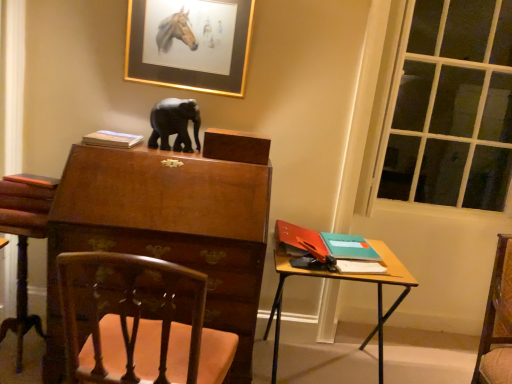
Question: From a real-world perspective, is matte paper book at upper left, the 1th book when ordered from left to right, positioned under transparent glass window at right based on gravity?

Choices:
 (A) yes
 (B) no

Answer: (B)

Question: Does matte paper book at upper left, the third book when ordered from right to left, have a lesser height compared to transparent glass window at right?

Choices:
 (A) yes
 (B) no

Answer: (A)

Question: Is transparent glass window at right completely or partially inside matte paper book at upper left, the 3th book from the bottom?

Choices:
 (A) no
 (B) yes

Answer: (A)

Question: Does matte paper book at upper left, the 1th book when ordered from left to right, lie in front of transparent glass window at right?

Choices:
 (A) yes
 (B) no

Answer: (A)

Question: From a real-world perspective, is matte paper book at upper left, the first book viewed from the top, physically above transparent glass window at right?

Choices:
 (A) yes
 (B) no

Answer: (A)

Question: Considering the positions of gold-framed picture at upper center and transparent glass window at right in the image, is gold-framed picture at upper center taller or shorter than transparent glass window at right?

Choices:
 (A) short
 (B) tall

Answer: (A)

Question: Looking at their shapes, would you say gold-framed picture at upper center is wider or thinner than transparent glass window at right?

Choices:
 (A) thin
 (B) wide

Answer: (B)

Question: Is gold-framed picture at upper center inside the boundaries of transparent glass window at right, or outside?

Choices:
 (A) inside
 (B) outside

Answer: (B)

Question: Considering the positions of gold-framed picture at upper center and transparent glass window at right in the image, is gold-framed picture at upper center bigger or smaller than transparent glass window at right?

Choices:
 (A) small
 (B) big

Answer: (A)

Question: Is wooden carved chair at lower left wider or thinner than wooden desk at right?

Choices:
 (A) thin
 (B) wide

Answer: (A)

Question: Based on their sizes in the image, would you say wooden carved chair at lower left is bigger or smaller than wooden desk at right?

Choices:
 (A) big
 (B) small

Answer: (B)

Question: Considering their positions, is wooden carved chair at lower left located in front of or behind wooden desk at right?

Choices:
 (A) behind
 (B) front

Answer: (A)

Question: Does point (29, 195) appear closer or farther from the camera than point (301, 274)?

Choices:
 (A) closer
 (B) farther

Answer: (A)

Question: In terms of size, does transparent glass window at right appear bigger or smaller than wooden carved chair at lower left?

Choices:
 (A) small
 (B) big

Answer: (A)

Question: Is point (454, 175) closer or farther from the camera than point (241, 367)?

Choices:
 (A) closer
 (B) farther

Answer: (B)